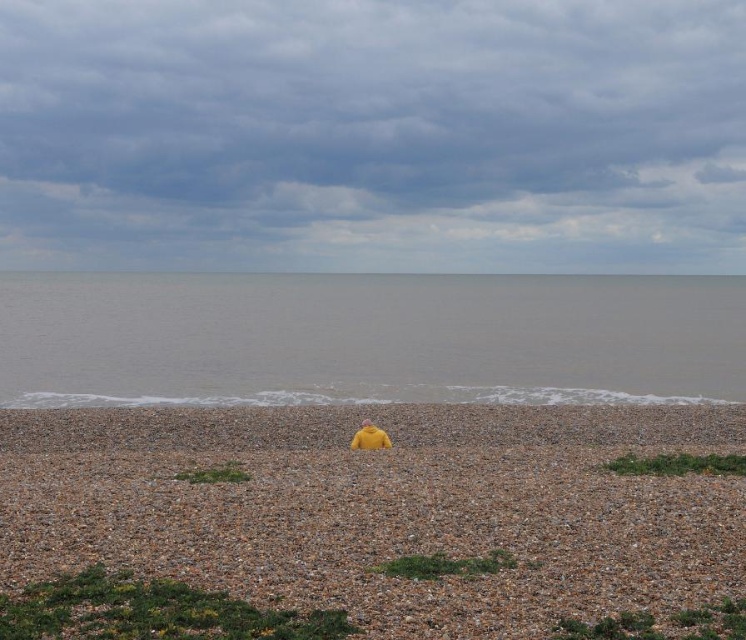
In the scene shown: You are a photographer setting up equipment on the pebble beach. You have a yellow fabric at center and a gray matte water at center in your viewfinder. Which object occupies a smaller horizontal space in the frame?

The yellow fabric at center has a lesser width compared to the gray matte water at center, so the yellow fabric at center occupies a smaller horizontal space in the frame.

Based on the photo, you are standing on the pebble beach and see the yellow fabric at center and the gray matte water at center. Which object is closer to you?

The yellow fabric at center is closer to you because it is in front of the gray matte water at center.